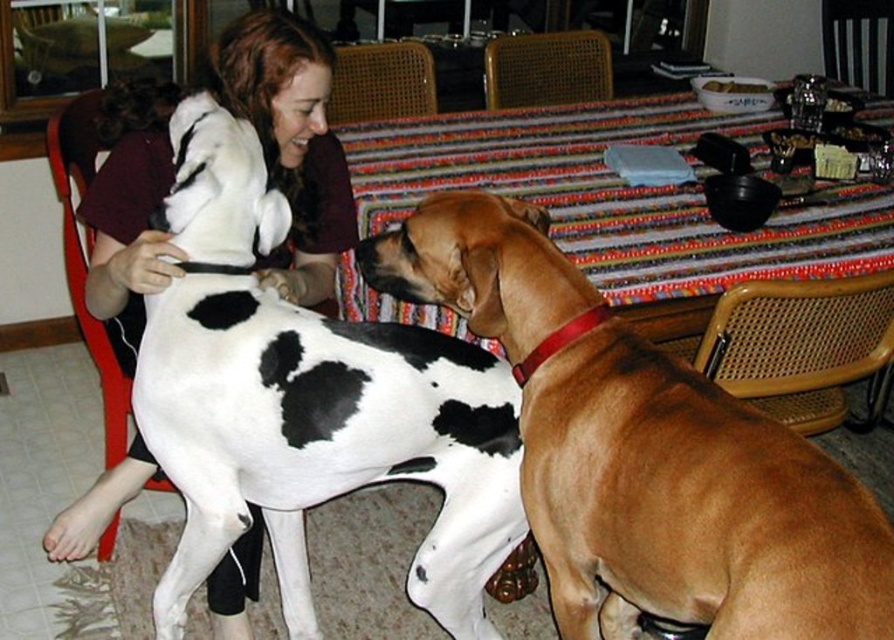
Question: Is brown smooth dog at center below braided wood chair at lower right?

Choices:
 (A) no
 (B) yes

Answer: (B)

Question: Which object is positioned closest to the white-spotted fur dog at center?

Choices:
 (A) brown smooth dog at center
 (B) matte black shirt at upper left

Answer: (A)

Question: Considering the relative positions of matte black shirt at upper left and woven cane chair at center in the image provided, where is matte black shirt at upper left located with respect to woven cane chair at center?

Choices:
 (A) left
 (B) right

Answer: (A)

Question: Among these objects, which one is nearest to the camera?

Choices:
 (A) white-spotted fur dog at center
 (B) braided wood chair at lower right
 (C) matte black shirt at upper left
 (D) woven cane chair at center

Answer: (A)

Question: Can you confirm if brown smooth dog at center is wider than brown woven chair at center?

Choices:
 (A) yes
 (B) no

Answer: (A)

Question: Which of these objects is positioned closest to the woven wood chair at upper center?

Choices:
 (A) striped fabric table at center
 (B) matte black shirt at upper left

Answer: (A)